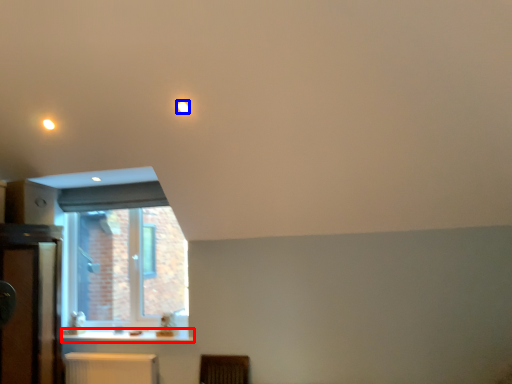
Question: Which object appears farthest to the camera in this image, counter top (highlighted by a red box) or lighting (highlighted by a blue box)?

Choices:
 (A) counter top
 (B) lighting

Answer: (A)